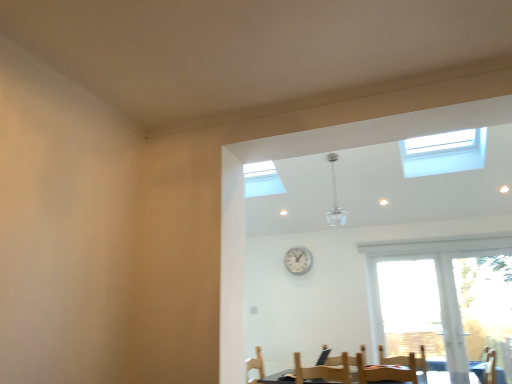
Question: From a real-world perspective, is wooden armchair at lower right under wooden chair at lower center?

Choices:
 (A) yes
 (B) no

Answer: (B)

Question: Can you confirm if wooden armchair at lower right is thinner than wooden chair at lower center?

Choices:
 (A) yes
 (B) no

Answer: (B)

Question: Would you say wooden armchair at lower right is a long distance from wooden chair at lower center?

Choices:
 (A) yes
 (B) no

Answer: (B)

Question: Is wooden armchair at lower right to the left of wooden chair at lower center from the viewer's perspective?

Choices:
 (A) no
 (B) yes

Answer: (A)

Question: Does wooden armchair at lower right have a larger size compared to wooden chair at lower center?

Choices:
 (A) yes
 (B) no

Answer: (A)

Question: From the image's perspective, is wooden armchair at lower right over wooden chair at lower center?

Choices:
 (A) no
 (B) yes

Answer: (A)

Question: Is wooden chair at lower center wider than wooden armchair at lower right?

Choices:
 (A) yes
 (B) no

Answer: (B)

Question: Is the depth of wooden chair at lower center greater than that of wooden armchair at lower right?

Choices:
 (A) yes
 (B) no

Answer: (B)

Question: Is wooden chair at lower center closer to the viewer compared to wooden armchair at lower right?

Choices:
 (A) no
 (B) yes

Answer: (B)

Question: Considering the relative sizes of wooden chair at lower center and wooden armchair at lower right in the image provided, is wooden chair at lower center thinner than wooden armchair at lower right?

Choices:
 (A) yes
 (B) no

Answer: (A)

Question: Does wooden chair at lower center have a larger size compared to wooden armchair at lower right?

Choices:
 (A) no
 (B) yes

Answer: (A)

Question: Can you confirm if wooden chair at lower center is smaller than wooden armchair at lower right?

Choices:
 (A) no
 (B) yes

Answer: (B)

Question: Is silver metallic clock at center bigger than wooden chair at lower center?

Choices:
 (A) yes
 (B) no

Answer: (B)